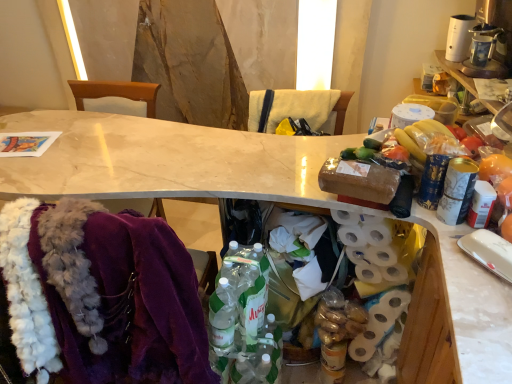
Where is `vacant area on top of white marble desk at center (from a real-world perspective)`? This screenshot has width=512, height=384. vacant area on top of white marble desk at center (from a real-world perspective) is located at coordinates (180, 146).